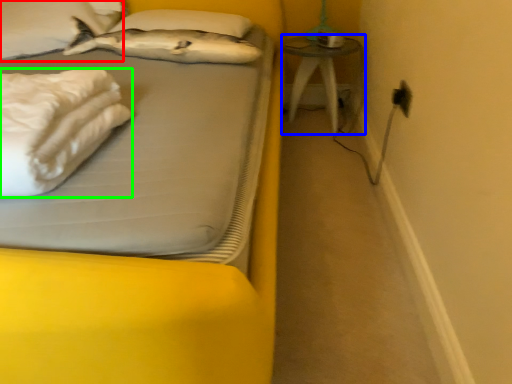
Question: Which object is the farthest from pillow (highlighted by a red box)? Choose among these: table (highlighted by a blue box) or material (highlighted by a green box).

Choices:
 (A) table
 (B) material

Answer: (A)